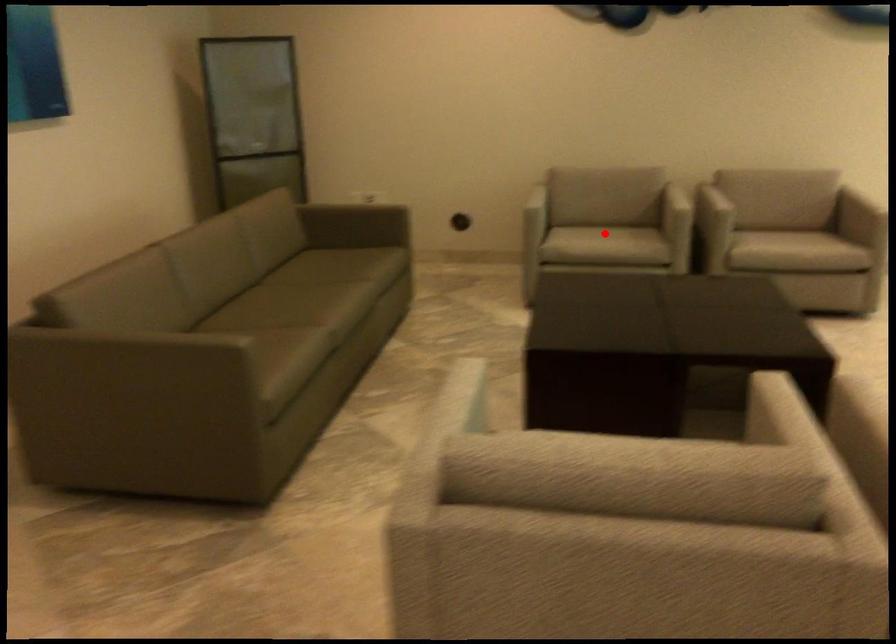
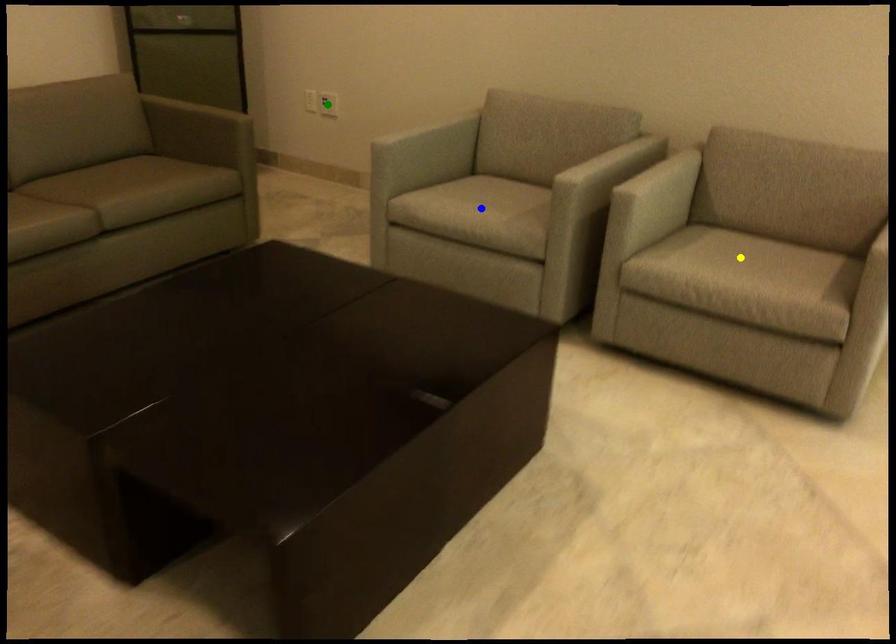
Question: I am providing you with two images of the same scene from different viewpoints. A red point is marked on the first image. You are given multiple points on the second image. Which mark in image 2 goes with the point in image 1?

Choices:
 (A) green point
 (B) blue point
 (C) yellow point

Answer: (B)